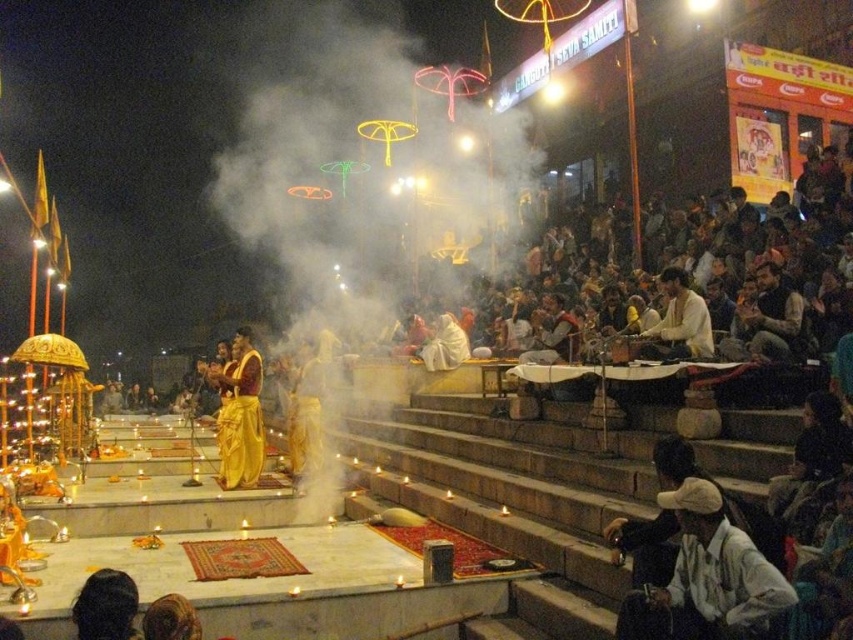
Is point (737, 544) positioned in front of point (245, 404)?

Yes, it is in front of point (245, 404).

You are a GUI agent. You are given a task and a screenshot of the screen. Output one action in this format:
    pyautogui.click(x=<x>, y=<y>)
    Task: Click on the white cotton cap at lower right
    
    Given the screenshot: What is the action you would take?
    pyautogui.click(x=720, y=563)

Does white cotton cap at lower right have a greater height compared to white cotton shirt at center?

In fact, white cotton cap at lower right may be shorter than white cotton shirt at center.

At what (x,y) coordinates should I click in order to perform the action: click on white cotton cap at lower right. Please return your answer as a coordinate pair (x, y). Image resolution: width=853 pixels, height=640 pixels. Looking at the image, I should click on (720, 563).

Can you confirm if golden silk sari at center is positioned to the right of white cotton shirt at center?

In fact, golden silk sari at center is to the left of white cotton shirt at center.

Is point (251, 438) farther from viewer compared to point (683, 307)?

Yes, it is behind point (683, 307).

Between point (223, 420) and point (666, 280), which one is positioned behind?

Positioned behind is point (223, 420).

Find the location of `golden silk sari at center`. golden silk sari at center is located at coordinates (239, 413).